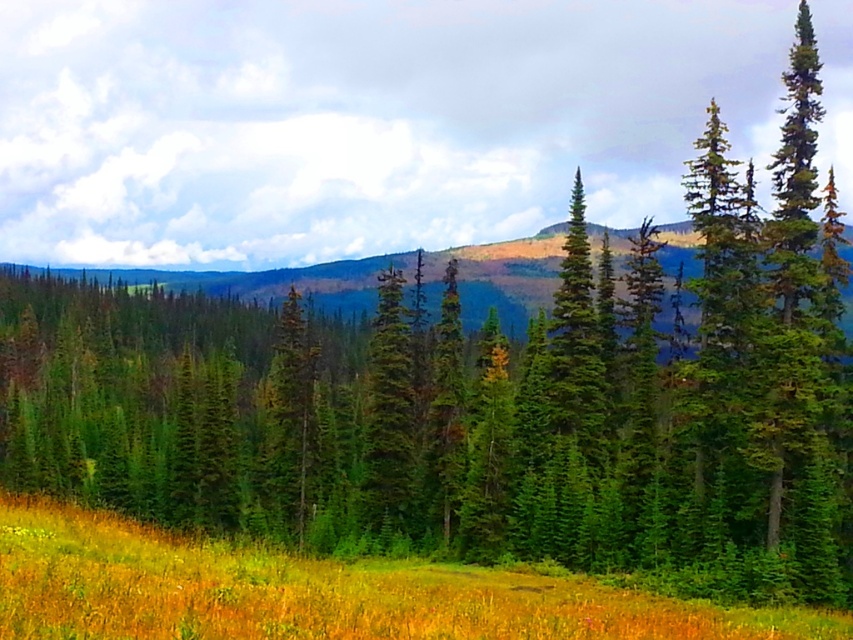
Question: Which point appears farthest from the camera in this image?

Choices:
 (A) (380, 609)
 (B) (374, 456)

Answer: (B)

Question: Which of the following is the closest to the observer?

Choices:
 (A) yellow-green grass at lower center
 (B) green matte tree at center

Answer: (A)

Question: Does yellow-green grass at lower center have a lesser width compared to green matte tree at center?

Choices:
 (A) no
 (B) yes

Answer: (A)

Question: Which point is farther from the camera taking this photo?

Choices:
 (A) (366, 474)
 (B) (358, 592)

Answer: (A)

Question: Can you confirm if yellow-green grass at lower center is thinner than green matte tree at center?

Choices:
 (A) no
 (B) yes

Answer: (A)

Question: Can you confirm if yellow-green grass at lower center is positioned below green matte tree at center?

Choices:
 (A) yes
 (B) no

Answer: (A)